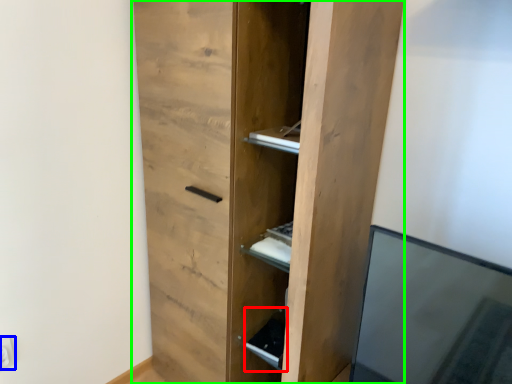
Question: Which is farther away from cabinet (highlighted by a red box)? electric outlet (highlighted by a blue box) or cupboard (highlighted by a green box)?

Choices:
 (A) electric outlet
 (B) cupboard

Answer: (A)